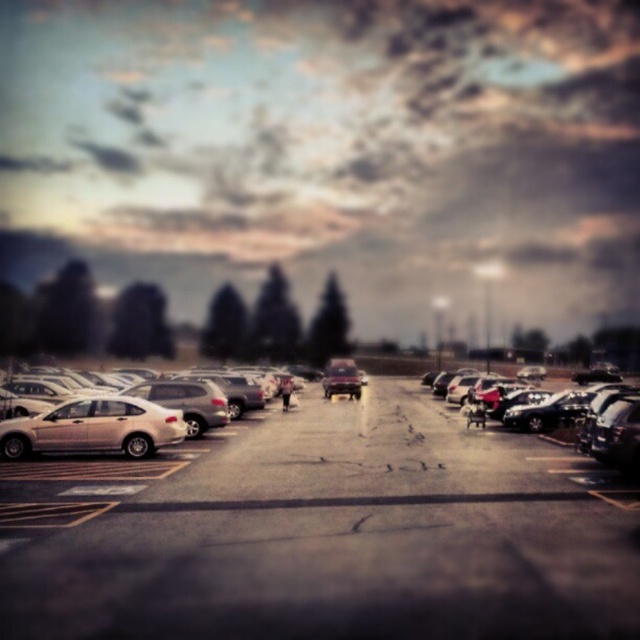
Does white matte car at center have a larger size compared to shiny black sedan at center?

Correct, white matte car at center is larger in size than shiny black sedan at center.

Is point (310, 490) less distant than point (621, 449)?

Yes.

The image size is (640, 640). Identify the location of white matte car at center. (321, 532).

Can you confirm if silver metallic sedan at center-left is thinner than shiny metallic car at center?

No, silver metallic sedan at center-left is not thinner than shiny metallic car at center.

Is silver metallic sedan at center-left to the left of shiny metallic car at center from the viewer's perspective?

Yes, silver metallic sedan at center-left is to the left of shiny metallic car at center.

You are a GUI agent. You are given a task and a screenshot of the screen. Output one action in this format:
    pyautogui.click(x=<x>, y=<y>)
    Task: Click on the silver metallic sedan at center-left
    The width and height of the screenshot is (640, 640).
    Given the screenshot: What is the action you would take?
    pyautogui.click(x=116, y=420)

Which is below, satin silver sedan at left or shiny black sedan at center?

shiny black sedan at center is below.

Is satin silver sedan at left bigger than shiny black sedan at center?

Actually, satin silver sedan at left might be smaller than shiny black sedan at center.

Is point (168, 442) closer to camera compared to point (618, 440)?

No, it is not.

Locate an element on the screen. This screenshot has height=640, width=640. satin silver sedan at left is located at coordinates point(93,428).